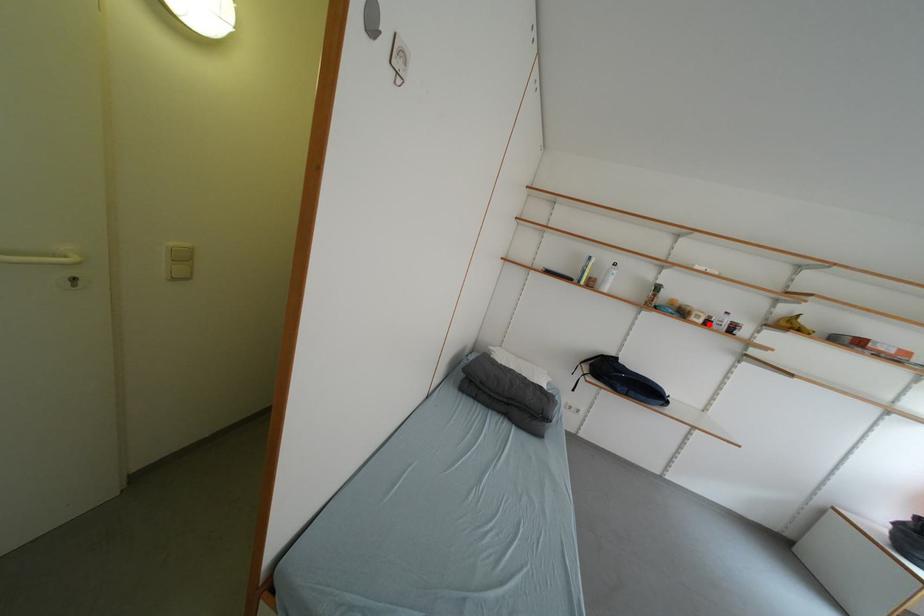
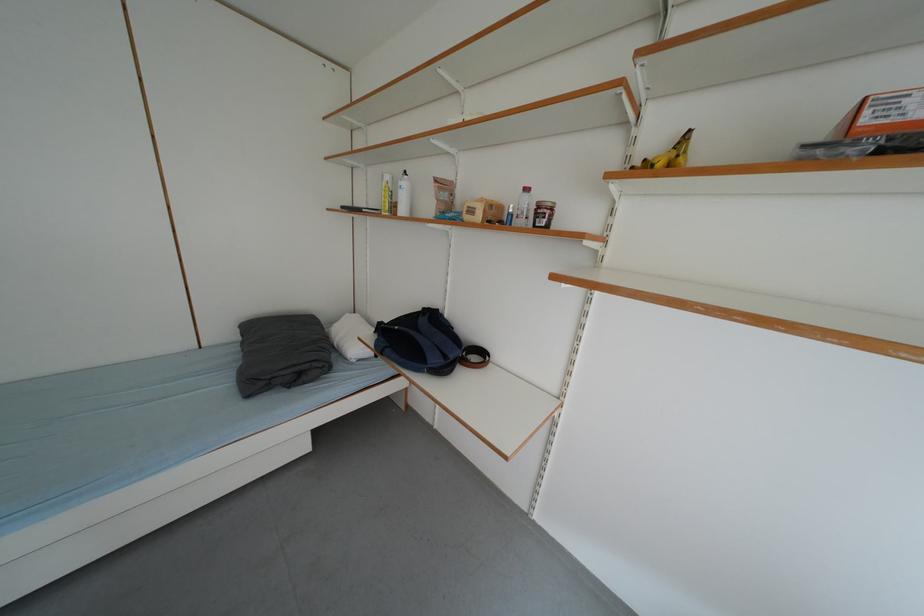
Where in the second image is the point corresponding to the highlighted location from the first image?

(487, 220)